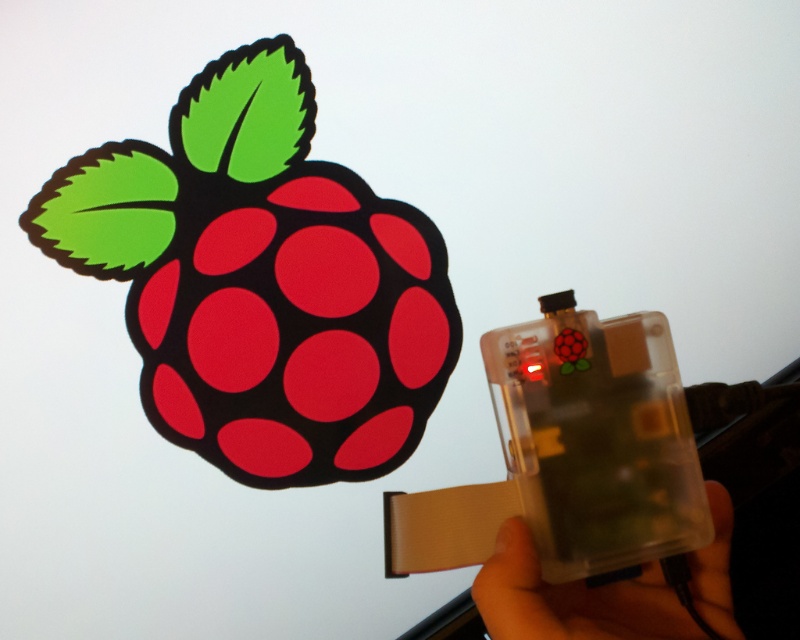
Who is lower down, matte plastic raspberry at upper left or clear plastic hand at lower right?

clear plastic hand at lower right is lower down.

Does point (254, 314) come closer to viewer compared to point (676, 618)?

No, (254, 314) is behind (676, 618).

Locate an element on the screen. The width and height of the screenshot is (800, 640). matte plastic raspberry at upper left is located at coordinates (262, 280).